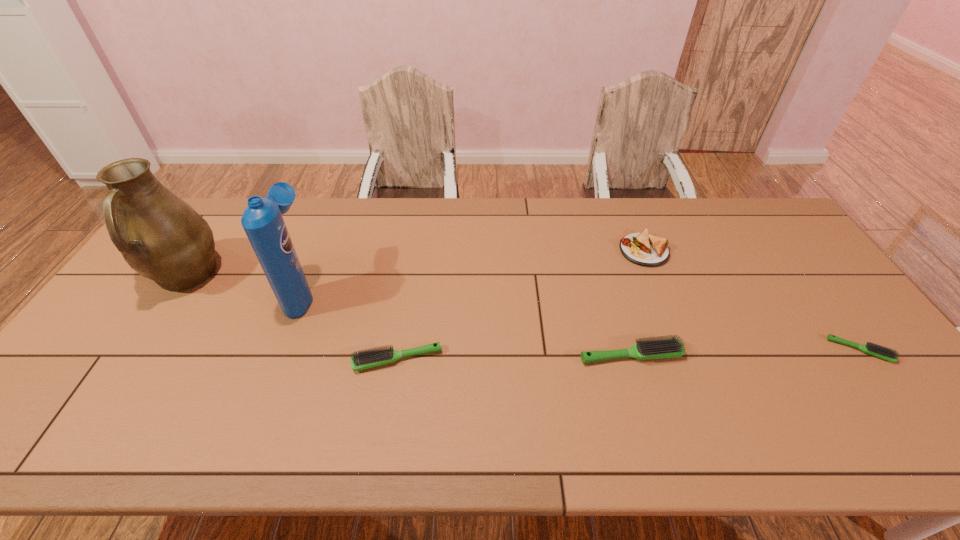
Locate an element on the screen. The image size is (960, 540). the leftmost hairbrush is located at coordinates (372, 357).

Locate an element on the screen. The image size is (960, 540). the fourth object from right to left is located at coordinates (372, 357).

Where is `the second hairbrush from left to right`? This screenshot has width=960, height=540. the second hairbrush from left to right is located at coordinates (662, 348).

You are a GUI agent. You are given a task and a screenshot of the screen. Output one action in this format:
    pyautogui.click(x=<x>, y=<y>)
    Task: Click on the shortest object
    This screenshot has width=960, height=540.
    Given the screenshot: What is the action you would take?
    pyautogui.click(x=870, y=348)

Identify the location of the rightmost object. (870, 348).

The image size is (960, 540). I want to click on sandwich, so click(x=644, y=249).

Find the location of a particular element. This screenshot has width=960, height=540. the second object from left to right is located at coordinates (262, 220).

The height and width of the screenshot is (540, 960). I want to click on pitcher, so click(160, 236).

The image size is (960, 540). I want to click on free space located 0.330m on the back of the second shortest hairbrush, so click(x=413, y=260).

I want to click on free space located 0.210m on the back of the second hairbrush from left to right, so click(x=611, y=286).